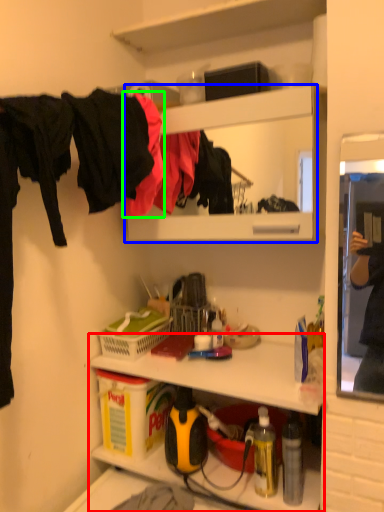
Question: Based on their relative distances, which object is farther from shelf (highlighted by a red box)? Choose from cabinet (highlighted by a blue box) and clothing (highlighted by a green box).

Choices:
 (A) cabinet
 (B) clothing

Answer: (A)